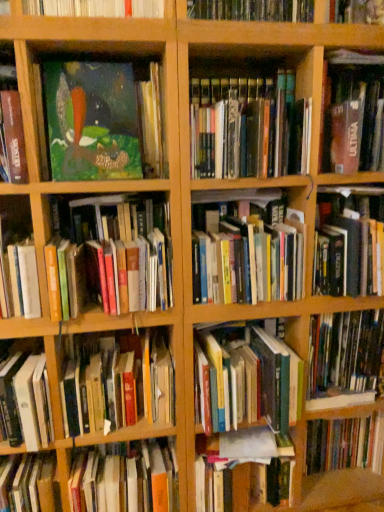
Question: Considering the relative positions of hardcover book at center, which appears as the first book when ordered from the bottom, and hardcover book at left, acting as the eighth book starting from the top, in the image provided, is hardcover book at center, which appears as the first book when ordered from the bottom, to the left or to the right of hardcover book at left, acting as the eighth book starting from the top,?

Choices:
 (A) right
 (B) left

Answer: (A)

Question: In terms of width, does hardcover book at center, arranged as the fifteenth book when viewed from the top, look wider or thinner when compared to hardcover book at left, acting as the eighth book starting from the top?

Choices:
 (A) thin
 (B) wide

Answer: (A)

Question: Estimate the real-world distances between objects in this image. Which object is closer to the hardcover book at lower left, the fourth book when ordered from bottom to top?

Choices:
 (A) wooden bookshelf at upper left, the first shelf when ordered from left to right
 (B) hardcover books at center left, the 9th book ordered from the bottom
 (C) hardcover book at center right, the 11th book when ordered from bottom to top
 (D) hardcover book at upper right, the 1th book when ordered from top to bottom
 (E) hardcover book at lower right, acting as the 13th book starting from the top

Answer: (B)

Question: Considering the real-world distances, which object is closest to the hardcover book at lower right, the third book from the bottom?

Choices:
 (A) hardcover book at lower left, the fourth book when ordered from bottom to top
 (B) hardcover book at upper right, the 1th book when ordered from top to bottom
 (C) hardcover book at center, which is the 2th book in bottom-to-top order
 (D) wooden bookshelf at upper center, marked as the 1th shelf in a right-to-left arrangement
 (E) hardcover book at center, placed as the 5th book when sorted from bottom to top

Answer: (C)